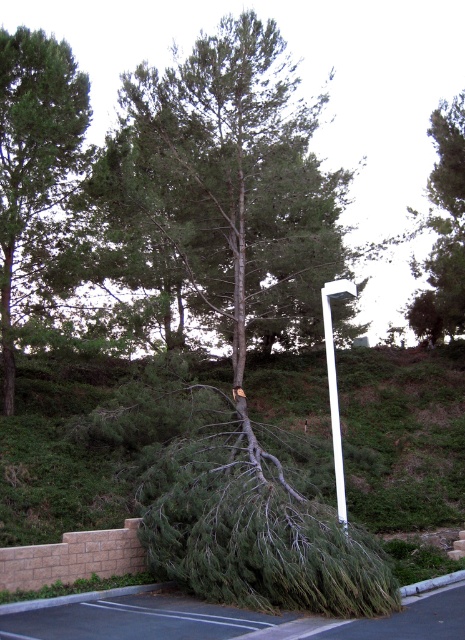
Which is behind, point (318, 224) or point (350, 292)?

The point (318, 224) is behind.

Who is higher up, green rough bark tree at center or white glossy street sign at center?

green rough bark tree at center

Which is in front, point (167, 156) or point (324, 304)?

Point (324, 304)

Find the location of a particular element. The image size is (465, 640). green rough bark tree at center is located at coordinates (216, 198).

Is green leafy tree at upper left above brushed metal curb at lower right?

Yes, green leafy tree at upper left is above brushed metal curb at lower right.

Between point (6, 145) and point (453, 579), which one is positioned behind?

Point (6, 145)

Is point (10, 168) less distant than point (436, 579)?

No, it is behind (436, 579).

Find the location of `green leafy tree at upper left`. green leafy tree at upper left is located at coordinates (33, 148).

Does green rough bark tree at center have a lesser height compared to brushed metal curb at lower right?

Incorrect, green rough bark tree at center's height does not fall short of brushed metal curb at lower right's.

Can you confirm if green rough bark tree at center is smaller than brushed metal curb at lower right?

Incorrect, green rough bark tree at center is not smaller in size than brushed metal curb at lower right.

Locate an element on the screen. The width and height of the screenshot is (465, 640). green rough bark tree at center is located at coordinates (216, 198).

At what (x,y) coordinates should I click in order to perform the action: click on green rough bark tree at center. Please return your answer as a coordinate pair (x, y). The width and height of the screenshot is (465, 640). Looking at the image, I should click on 216,198.